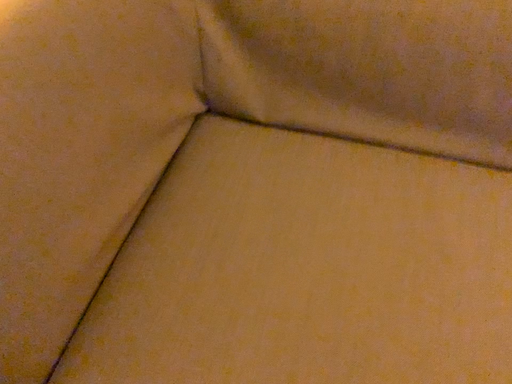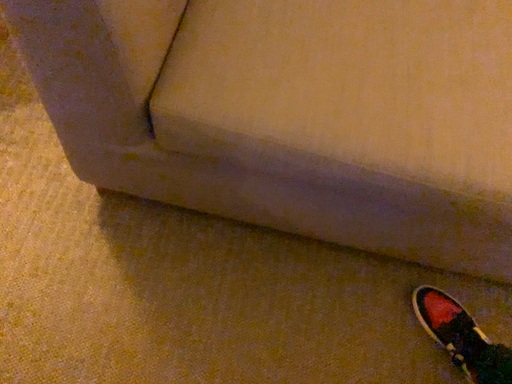
Question: How did the camera likely rotate when shooting the video?

Choices:
 (A) rotated right
 (B) rotated left

Answer: (A)